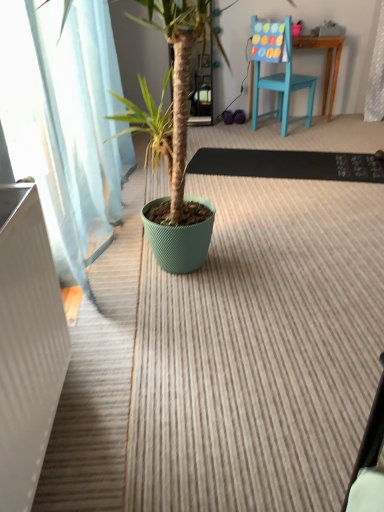
Question: Is rug at center, the 2th doormat positioned from the top, taller than black rubber doormat at center, the 2th doormat positioned from the bottom?

Choices:
 (A) no
 (B) yes

Answer: (A)

Question: From the image's perspective, is rug at center, the 2th doormat positioned from the top, located beneath black rubber doormat at center, the 2th doormat positioned from the bottom?

Choices:
 (A) yes
 (B) no

Answer: (A)

Question: From a real-world perspective, is rug at center, the 2th doormat positioned from the top, on black rubber doormat at center, positioned as the first doormat in top-to-bottom order?

Choices:
 (A) yes
 (B) no

Answer: (B)

Question: Is the surface of rug at center, the first doormat in the bottom-to-top sequence, in direct contact with black rubber doormat at center, the 2th doormat positioned from the bottom?

Choices:
 (A) no
 (B) yes

Answer: (A)

Question: Does rug at center, the first doormat in the bottom-to-top sequence, have a smaller size compared to black rubber doormat at center, the 2th doormat positioned from the bottom?

Choices:
 (A) no
 (B) yes

Answer: (A)

Question: Does point (195, 166) appear closer or farther from the camera than point (206, 510)?

Choices:
 (A) farther
 (B) closer

Answer: (A)

Question: In terms of width, does black rubber doormat at center, the 2th doormat positioned from the bottom, look wider or thinner when compared to rug at center, the 2th doormat positioned from the top?

Choices:
 (A) wide
 (B) thin

Answer: (B)

Question: Choose the correct answer: Is black rubber doormat at center, positioned as the first doormat in top-to-bottom order, inside rug at center, the first doormat in the bottom-to-top sequence, or outside it?

Choices:
 (A) inside
 (B) outside

Answer: (A)

Question: From the image's perspective, is black rubber doormat at center, positioned as the first doormat in top-to-bottom order, positioned above or below rug at center, the 2th doormat positioned from the top?

Choices:
 (A) below
 (B) above

Answer: (B)

Question: Considering the positions of teal wooden chair at upper right and white ribbed radiator at left in the image, is teal wooden chair at upper right taller or shorter than white ribbed radiator at left?

Choices:
 (A) tall
 (B) short

Answer: (A)

Question: From a real-world perspective, is teal wooden chair at upper right positioned above or below white ribbed radiator at left?

Choices:
 (A) below
 (B) above

Answer: (B)

Question: In the image, is teal wooden chair at upper right positioned in front of or behind white ribbed radiator at left?

Choices:
 (A) front
 (B) behind

Answer: (B)

Question: Would you say teal wooden chair at upper right is to the left or to the right of white ribbed radiator at left in the picture?

Choices:
 (A) left
 (B) right

Answer: (B)

Question: Is teal wooden chair at upper right situated inside rug at center, the first doormat in the bottom-to-top sequence, or outside?

Choices:
 (A) outside
 (B) inside

Answer: (A)

Question: Is teal wooden chair at upper right in front of or behind rug at center, the 2th doormat positioned from the top, in the image?

Choices:
 (A) behind
 (B) front

Answer: (A)